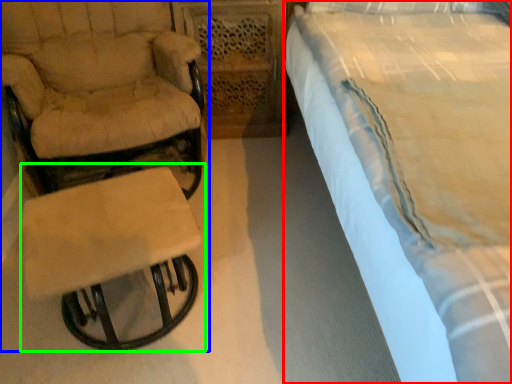
Question: Considering the real-world distances, which object is closest to bed (highlighted by a red box)? chair (highlighted by a blue box) or table (highlighted by a green box).

Choices:
 (A) chair
 (B) table

Answer: (B)